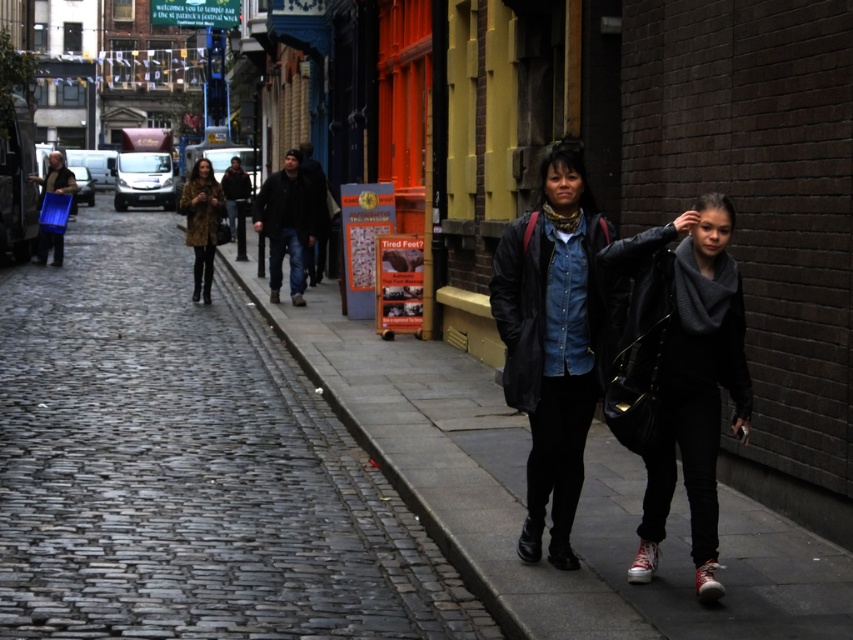
Question: Which point is closer to the camera taking this photo?

Choices:
 (A) (236, 216)
 (B) (36, 176)

Answer: (B)

Question: Based on their relative distances, which object is farther from the dark brown leather jacket at center?

Choices:
 (A) dark blue jeans at center
 (B) matte black jacket at center
 (C) denim jacket at center

Answer: (C)

Question: Among these points, which one is nearest to the camera?

Choices:
 (A) (194, 252)
 (B) (593, 220)
 (C) (514, 310)
 (D) (309, 230)

Answer: (C)

Question: Can you confirm if fluffy brown coat at center is positioned below blue plastic bag at left?

Choices:
 (A) no
 (B) yes

Answer: (B)

Question: Does denim jacket at center appear on the left side of blue plastic bag at left?

Choices:
 (A) no
 (B) yes

Answer: (A)

Question: Where is denim jacket at center located in relation to dark brown leather jacket at center in the image?

Choices:
 (A) left
 (B) right

Answer: (B)